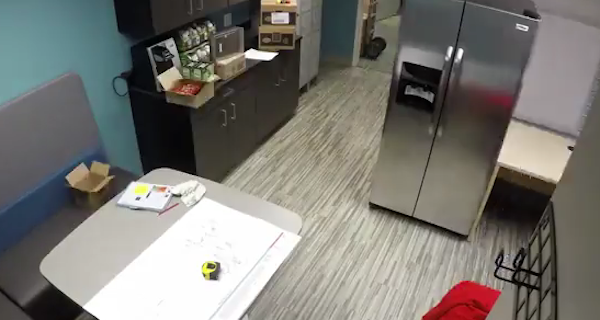
Locate an element on the screen. This screenshot has height=320, width=600. dark brown cabinet is located at coordinates coord(277,97), coord(226,129), coord(154,124), coord(163,17), coord(217,3).